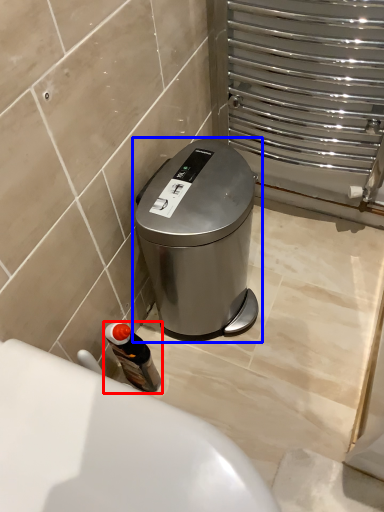
Question: Among these objects, which one is farthest to the camera, bottle (highlighted by a red box) or waste container (highlighted by a blue box)?

Choices:
 (A) bottle
 (B) waste container

Answer: (A)